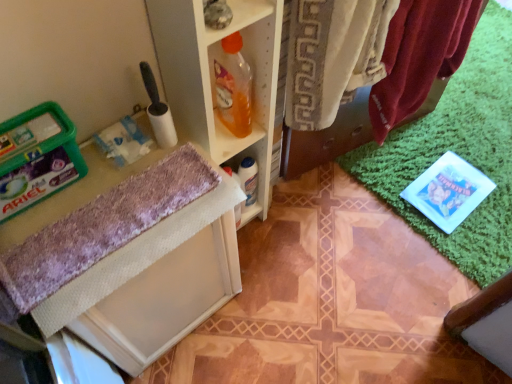
Where is `blank area beneath velvet-like red towel at upper right (from a real-world perspective)`? The image size is (512, 384). blank area beneath velvet-like red towel at upper right (from a real-world perspective) is located at coordinates (315, 226).